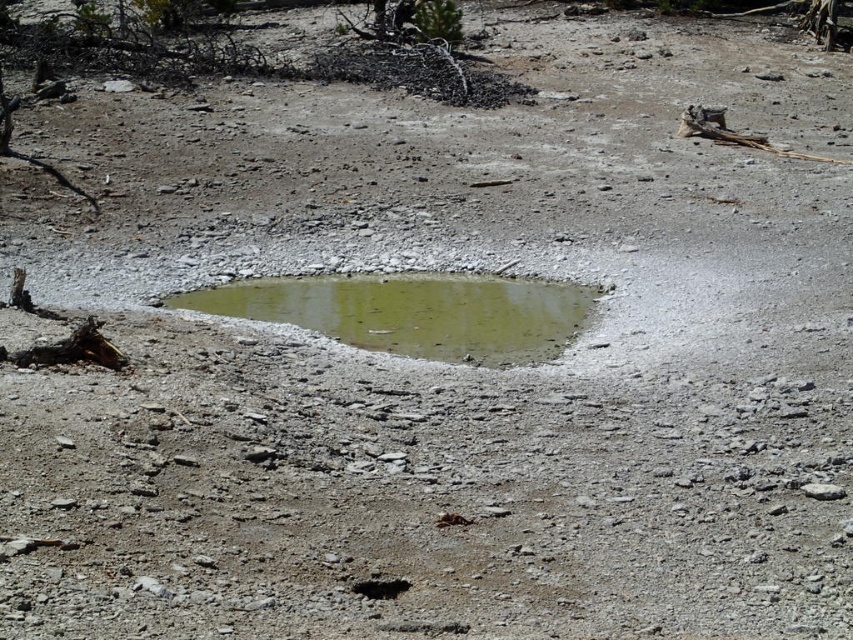
Question: Which point is farther to the camera?

Choices:
 (A) green mud puddle at center
 (B) dark brown dirt hole at center

Answer: (A)

Question: Which point is closer to the camera?

Choices:
 (A) green mud puddle at center
 (B) dark brown dirt hole at center

Answer: (B)

Question: Considering the relative positions of green mud puddle at center and dark brown dirt hole at center in the image provided, where is green mud puddle at center located with respect to dark brown dirt hole at center?

Choices:
 (A) left
 (B) right

Answer: (A)

Question: Is green mud puddle at center to the left of dark brown dirt hole at center from the viewer's perspective?

Choices:
 (A) yes
 (B) no

Answer: (A)

Question: Does green mud puddle at center appear under dark brown dirt hole at center?

Choices:
 (A) yes
 (B) no

Answer: (B)